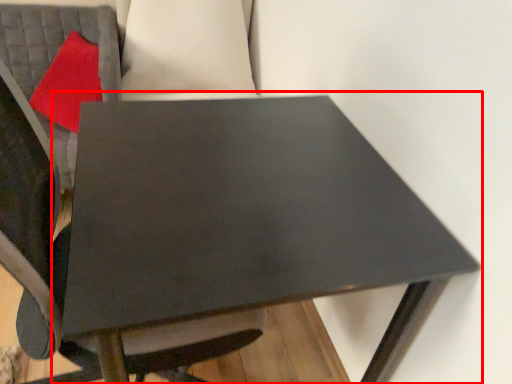
Question: From the image's perspective, what is the correct spatial positioning of table (annotated by the red box) in reference to pillow?

Choices:
 (A) below
 (B) above

Answer: (A)